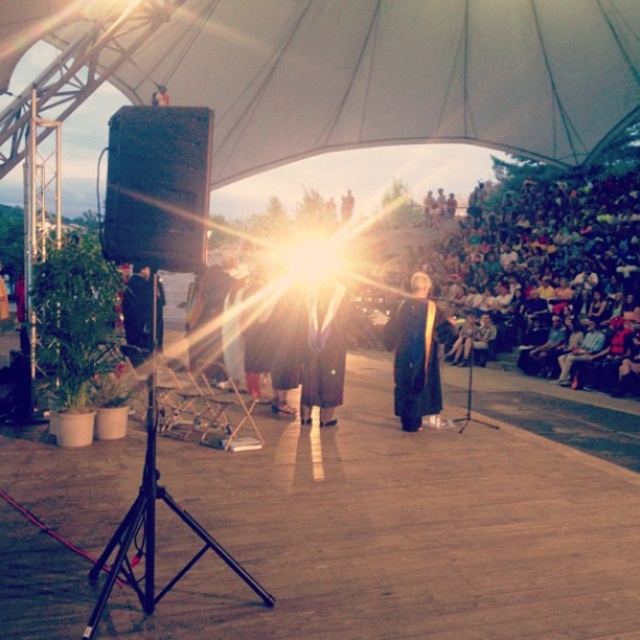
Question: Based on their relative distances, which object is farther from the black matte gown at center?

Choices:
 (A) white fabric canopy at upper center
 (B) wooden stage at center

Answer: (A)

Question: Does wooden stage at center appear under black metal tripod at left?

Choices:
 (A) yes
 (B) no

Answer: (A)

Question: Among these points, which one is nearest to the camera?

Choices:
 (A) (403, 333)
 (B) (138, 61)

Answer: (A)

Question: Is white fabric canopy at upper center above black matte gown at center?

Choices:
 (A) no
 (B) yes

Answer: (B)

Question: Which point is closer to the camera taking this photo?

Choices:
 (A) (148, 561)
 (B) (413, 403)

Answer: (A)

Question: Does white fabric canopy at upper center appear under black metal tripod at left?

Choices:
 (A) yes
 (B) no

Answer: (B)